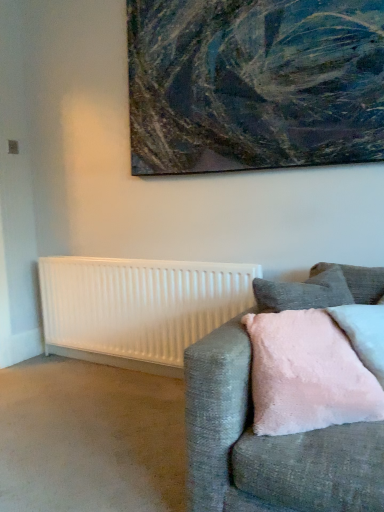
Question: Is textured canvas painting at upper center to the right of white matte radiator at lower left from the viewer's perspective?

Choices:
 (A) no
 (B) yes

Answer: (B)

Question: Does textured canvas painting at upper center have a lesser height compared to white matte radiator at lower left?

Choices:
 (A) yes
 (B) no

Answer: (B)

Question: Considering the relative sizes of textured canvas painting at upper center and white matte radiator at lower left in the image provided, is textured canvas painting at upper center wider than white matte radiator at lower left?

Choices:
 (A) yes
 (B) no

Answer: (B)

Question: Does textured canvas painting at upper center have a larger size compared to white matte radiator at lower left?

Choices:
 (A) yes
 (B) no

Answer: (A)

Question: Is textured canvas painting at upper center far from white matte radiator at lower left?

Choices:
 (A) no
 (B) yes

Answer: (A)

Question: From a real-world perspective, relative to pink fluffy pillow at right, is textured gray couch at right vertically above or below?

Choices:
 (A) above
 (B) below

Answer: (B)

Question: From the image's perspective, relative to pink fluffy pillow at right, is textured gray couch at right above or below?

Choices:
 (A) below
 (B) above

Answer: (A)

Question: In the image, is textured gray couch at right positioned in front of or behind pink fluffy pillow at right?

Choices:
 (A) front
 (B) behind

Answer: (A)

Question: Would you say textured gray couch at right is to the left or to the right of pink fluffy pillow at right in the picture?

Choices:
 (A) right
 (B) left

Answer: (B)

Question: From the image's perspective, is textured canvas painting at upper center located above or below pink fluffy pillow at right?

Choices:
 (A) above
 (B) below

Answer: (A)

Question: Is textured canvas painting at upper center taller or shorter than pink fluffy pillow at right?

Choices:
 (A) short
 (B) tall

Answer: (B)

Question: Would you say textured canvas painting at upper center is inside or outside pink fluffy pillow at right?

Choices:
 (A) inside
 (B) outside

Answer: (B)

Question: In terms of size, does textured canvas painting at upper center appear bigger or smaller than pink fluffy pillow at right?

Choices:
 (A) small
 (B) big

Answer: (B)

Question: Is pink fluffy pillow at right inside or outside of white matte radiator at lower left?

Choices:
 (A) inside
 (B) outside

Answer: (B)

Question: Would you say pink fluffy pillow at right is to the left or to the right of white matte radiator at lower left in the picture?

Choices:
 (A) right
 (B) left

Answer: (A)